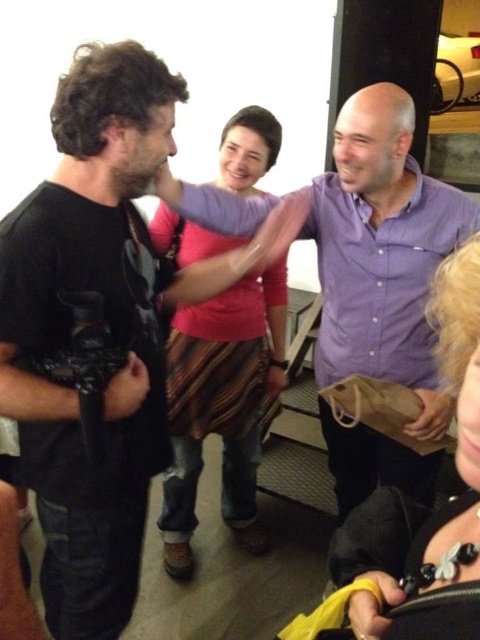
Is black matte camera at left above striped cotton skirt at center?

Yes.

Consider the image. Does black matte camera at left have a lesser width compared to striped cotton skirt at center?

In fact, black matte camera at left might be wider than striped cotton skirt at center.

Is point (142, 376) farther from camera compared to point (253, 476)?

No, (142, 376) is closer to viewer.

What are the coordinates of `black matte camera at left` in the screenshot? It's located at (99, 330).

This screenshot has height=640, width=480. Identify the location of purple button-down shirt at center. (383, 252).

Is the position of purple button-down shirt at center more distant than that of striped cotton skirt at center?

No, it is not.

Where is `purple button-down shirt at center`? The width and height of the screenshot is (480, 640). purple button-down shirt at center is located at coordinates (383, 252).

Is black matte camera at left to the left of blonde hair at lower right from the viewer's perspective?

Correct, you'll find black matte camera at left to the left of blonde hair at lower right.

Who is more distant from viewer, (52, 618) or (403, 634)?

The point (52, 618) is more distant.

At what (x,y) coordinates should I click in order to perform the action: click on black matte camera at left. Please return your answer as a coordinate pair (x, y). The width and height of the screenshot is (480, 640). Looking at the image, I should click on (99, 330).